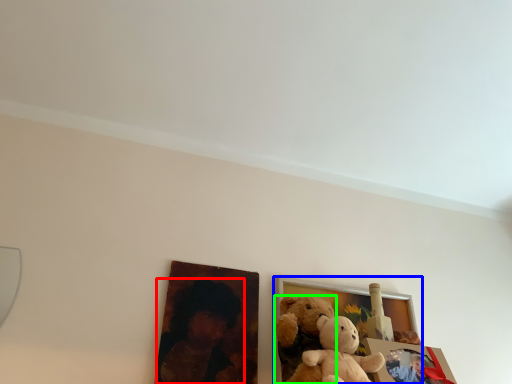
Question: Considering the real-world distances, which object is farthest from person (highlighted by a red box)? picture frame (highlighted by a blue box) or teddy bear (highlighted by a green box)?

Choices:
 (A) picture frame
 (B) teddy bear

Answer: (A)